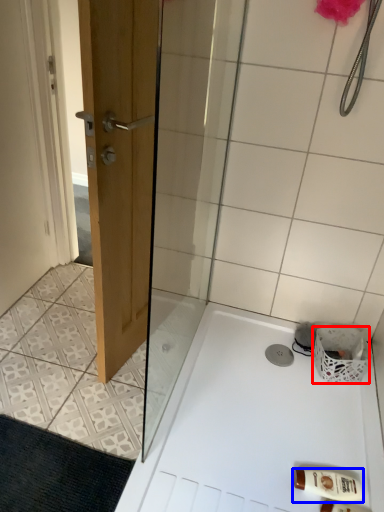
Question: Which object is further to the camera taking this photo, basket (highlighted by a red box) or toiletry (highlighted by a blue box)?

Choices:
 (A) basket
 (B) toiletry

Answer: (A)